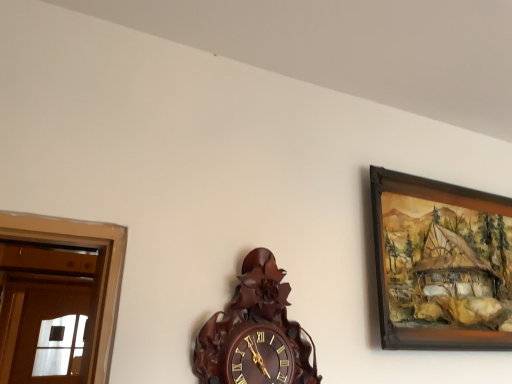
In order to face dark wood carved clock at center, should I rotate leftwards or rightwards?

A 1.285 degree turn to the right will do.

At what (x,y) coordinates should I click in order to perform the action: click on dark wood carved clock at center. Please return your answer as a coordinate pair (x, y). Image resolution: width=512 pixels, height=384 pixels. Looking at the image, I should click on (256, 333).

The height and width of the screenshot is (384, 512). What do you see at coordinates (256, 333) in the screenshot? I see `dark wood carved clock at center` at bounding box center [256, 333].

Describe the element at coordinates (441, 264) in the screenshot. I see `wooden-framed painting at upper right` at that location.

Image resolution: width=512 pixels, height=384 pixels. In order to click on wooden-framed painting at upper right in this screenshot , I will do `click(441, 264)`.

Find the location of `dark wood carved clock at center`. dark wood carved clock at center is located at coordinates (256, 333).

Which is more to the left, dark wood carved clock at center or wooden-framed painting at upper right?

From the viewer's perspective, dark wood carved clock at center appears more on the left side.

Considering the positions of objects dark wood carved clock at center and wooden-framed painting at upper right in the image provided, who is in front, dark wood carved clock at center or wooden-framed painting at upper right?

dark wood carved clock at center is in front.

Between point (260, 381) and point (499, 299), which one is positioned in front?

The point (260, 381) is in front.

Based on the photo, from the image's perspective, is dark wood carved clock at center under wooden-framed painting at upper right?

Yes, from the image's perspective, dark wood carved clock at center is beneath wooden-framed painting at upper right.

From a real-world perspective, is dark wood carved clock at center physically located above or below wooden-framed painting at upper right?

In terms of real-world spatial position, dark wood carved clock at center is below wooden-framed painting at upper right.

In terms of width, does dark wood carved clock at center look wider or thinner when compared to wooden-framed painting at upper right?

dark wood carved clock at center is wider than wooden-framed painting at upper right.

Considering the sizes of objects dark wood carved clock at center and wooden-framed painting at upper right in the image provided, who is shorter, dark wood carved clock at center or wooden-framed painting at upper right?

Standing shorter between the two is dark wood carved clock at center.

Is dark wood carved clock at center bigger than wooden-framed painting at upper right?

No.

Is dark wood carved clock at center inside or outside of wooden-framed painting at upper right?

dark wood carved clock at center is not enclosed by wooden-framed painting at upper right.

Is dark wood carved clock at center not close to wooden-framed painting at upper right?

No, there isn't a large distance between dark wood carved clock at center and wooden-framed painting at upper right.

Could you tell me if dark wood carved clock at center is facing wooden-framed painting at upper right?

No, dark wood carved clock at center does not turn towards wooden-framed painting at upper right.

What's the angular difference between dark wood carved clock at center and wooden-framed painting at upper right's facing directions?

0.00152 degrees separate the facing orientations of dark wood carved clock at center and wooden-framed painting at upper right.

Locate an element on the screen. This screenshot has height=384, width=512. wall clock directly beneath the wooden-framed painting at upper right (from a real-world perspective) is located at coordinates (256, 333).

Does wooden-framed painting at upper right appear on the left side of dark wood carved clock at center?

No, wooden-framed painting at upper right is not to the left of dark wood carved clock at center.

Who is more distant, wooden-framed painting at upper right or dark wood carved clock at center?

Positioned behind is wooden-framed painting at upper right.

Considering the positions of point (397, 257) and point (229, 376), is point (397, 257) closer or farther from the camera than point (229, 376)?

Clearly, point (397, 257) is more distant from the camera than point (229, 376).

From the image's perspective, between wooden-framed painting at upper right and dark wood carved clock at center, which one is located above?

From the image's view, wooden-framed painting at upper right is above.

From a real-world perspective, is wooden-framed painting at upper right below dark wood carved clock at center?

No.

Can you confirm if wooden-framed painting at upper right is wider than dark wood carved clock at center?

In fact, wooden-framed painting at upper right might be narrower than dark wood carved clock at center.

Which of these two, wooden-framed painting at upper right or dark wood carved clock at center, stands taller?

wooden-framed painting at upper right.

Considering the relative sizes of wooden-framed painting at upper right and dark wood carved clock at center in the image provided, is wooden-framed painting at upper right bigger than dark wood carved clock at center?

Yes, wooden-framed painting at upper right is bigger than dark wood carved clock at center.

Is dark wood carved clock at center completely or partially inside wooden-framed painting at upper right?

No, dark wood carved clock at center is not a part of wooden-framed painting at upper right.

Is wooden-framed painting at upper right far away from dark wood carved clock at center?

wooden-framed painting at upper right is actually quite close to dark wood carved clock at center.

Is wooden-framed painting at upper right facing towards dark wood carved clock at center?

No, wooden-framed painting at upper right does not turn towards dark wood carved clock at center.

Based on the photo, how different are the orientations of wooden-framed painting at upper right and dark wood carved clock at center in degrees?

There is a 0.00152-degree angle between the facing directions of wooden-framed painting at upper right and dark wood carved clock at center.

How distant is wooden-framed painting at upper right from dark wood carved clock at center?

The distance of wooden-framed painting at upper right from dark wood carved clock at center is 20.02 inches.

I want to click on wall clock below the wooden-framed painting at upper right (from a real-world perspective), so click(256, 333).

Find the location of `wall clock on the left of wooden-framed painting at upper right`. wall clock on the left of wooden-framed painting at upper right is located at coordinates (256, 333).

Find the location of a particular element. The width and height of the screenshot is (512, 384). wall clock that is in front of the wooden-framed painting at upper right is located at coordinates (256, 333).